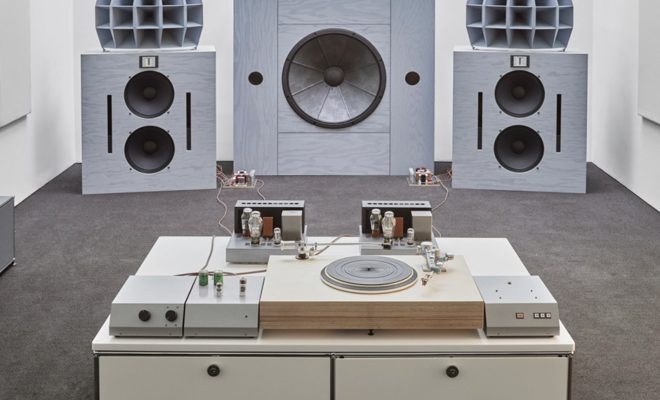
At what (x,y) coordinates should I click in order to perform the action: click on white table surface. Please return your answer as a coordinate pair (x, y). The height and width of the screenshot is (400, 660). Looking at the image, I should click on (168, 248).